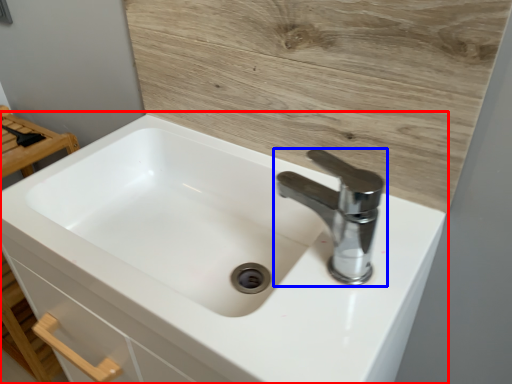
Question: Which object appears closest to the camera in this image, sink (highlighted by a red box) or tap (highlighted by a blue box)?

Choices:
 (A) sink
 (B) tap

Answer: (A)